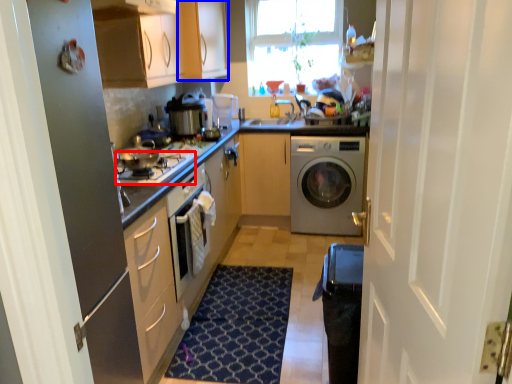
Question: Among these objects, which one is farthest to the camera, gas stove (highlighted by a red box) or cabinetry (highlighted by a blue box)?

Choices:
 (A) gas stove
 (B) cabinetry

Answer: (B)